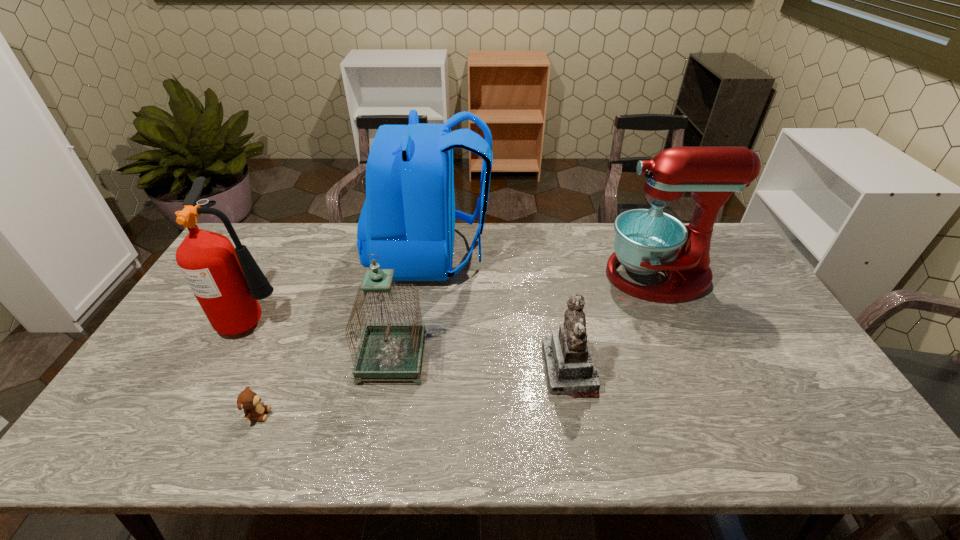
Identify the location of backpack. Image resolution: width=960 pixels, height=540 pixels. (408, 218).

The width and height of the screenshot is (960, 540). Identify the location of mixer. (647, 241).

The image size is (960, 540). Identify the location of fire extinguisher. (227, 282).

Identify the location of birdcage. This screenshot has width=960, height=540. (387, 350).

Locate an element on the screen. figurine is located at coordinates (570, 367).

Locate an element on the screen. Image resolution: width=960 pixels, height=540 pixels. the second shortest object is located at coordinates (570, 367).

At what (x,y) coordinates should I click in order to perform the action: click on the shortest object. Please return your answer as a coordinate pair (x, y). This screenshot has height=540, width=960. Looking at the image, I should click on (249, 401).

This screenshot has width=960, height=540. I want to click on the nearest object, so click(249, 401).

Find the location of `free spot located on the back of the backpack`. free spot located on the back of the backpack is located at coordinates (603, 254).

The width and height of the screenshot is (960, 540). I want to click on free location located on the front-facing side of the mixer, so click(x=518, y=276).